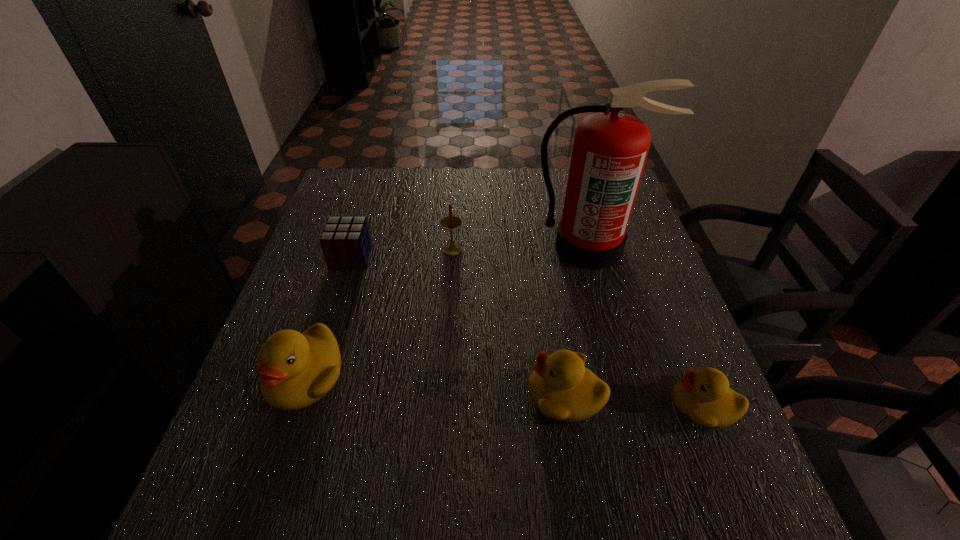
The image size is (960, 540). Identify the location of the leftmost duckling. (296, 369).

Image resolution: width=960 pixels, height=540 pixels. I want to click on the second tallest duckling, so click(x=561, y=387).

In order to click on the fourth tallest object in this screenshot , I will do `click(561, 387)`.

Where is `the shortest duckling`? This screenshot has width=960, height=540. the shortest duckling is located at coordinates (703, 397).

In order to click on fire extinguisher in this screenshot , I will do `click(610, 148)`.

Where is `cube`? This screenshot has height=540, width=960. cube is located at coordinates (345, 241).

The height and width of the screenshot is (540, 960). What are the coordinates of `the fourth object from right to left` in the screenshot? It's located at (451, 223).

This screenshot has height=540, width=960. Identify the location of free location located 0.080m on the front-facing side of the leftmost duckling. (277, 456).

Where is `vacant space located 0.050m on the front-facing side of the second duckling from right to left`? vacant space located 0.050m on the front-facing side of the second duckling from right to left is located at coordinates (502, 395).

Where is `vacant region located on the front-facing side of the second duckling from right to left`? vacant region located on the front-facing side of the second duckling from right to left is located at coordinates (415, 395).